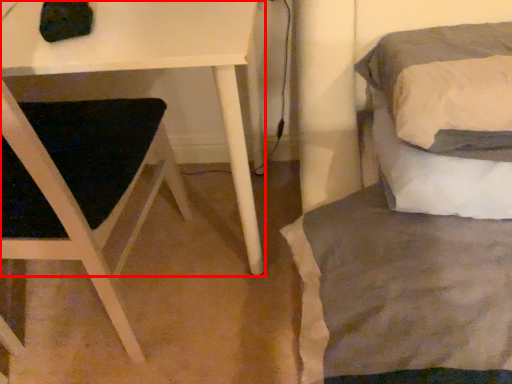
Question: From the image's perspective, what is the correct spatial positioning of table (annotated by the red box) in reference to bed?

Choices:
 (A) below
 (B) above

Answer: (A)